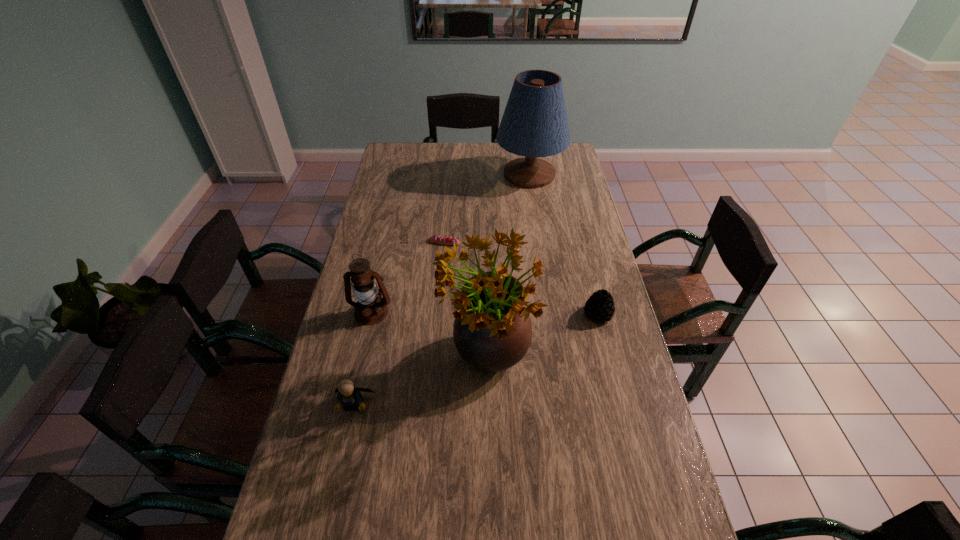
Where is `the farthest object`? the farthest object is located at coordinates (534, 124).

Find the location of a particular element. Image resolution: width=960 pixels, height=540 pixels. flower arrangement is located at coordinates (492, 331).

In order to click on lantern in this screenshot , I will do `click(370, 309)`.

I want to click on Lego, so click(x=348, y=395).

Find the location of a particular element. pinecone is located at coordinates (600, 306).

This screenshot has width=960, height=540. I want to click on eclair, so [x=442, y=240].

The height and width of the screenshot is (540, 960). Identify the location of the second farthest object. (442, 240).

I want to click on vacant position located on the front of the lampshade, so click(540, 246).

This screenshot has height=540, width=960. What are the coordinates of `free space located on the back of the flower arrangement` in the screenshot? It's located at (485, 243).

Identify the location of vacant area located 0.310m on the side of the lantern, there is a wick adjustment knob. (348, 417).